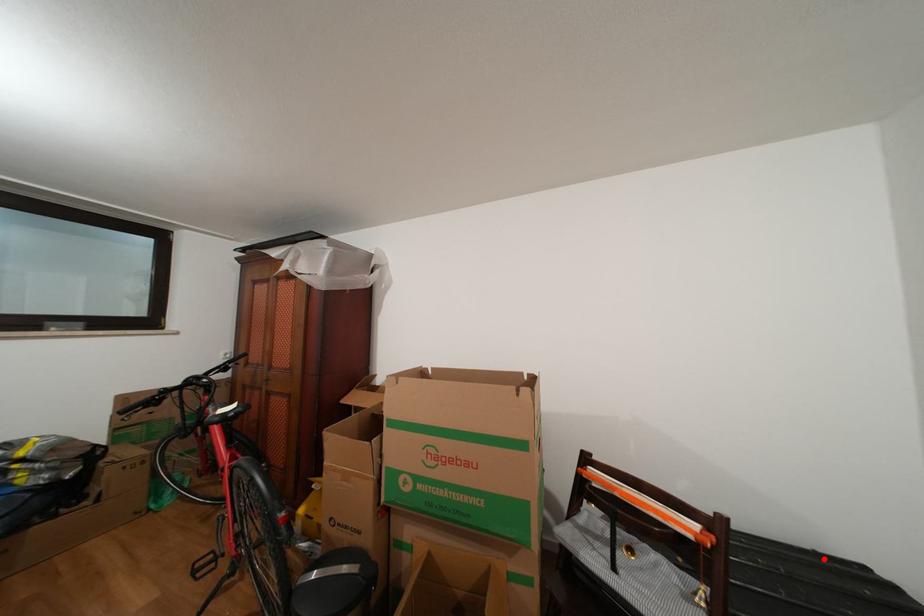
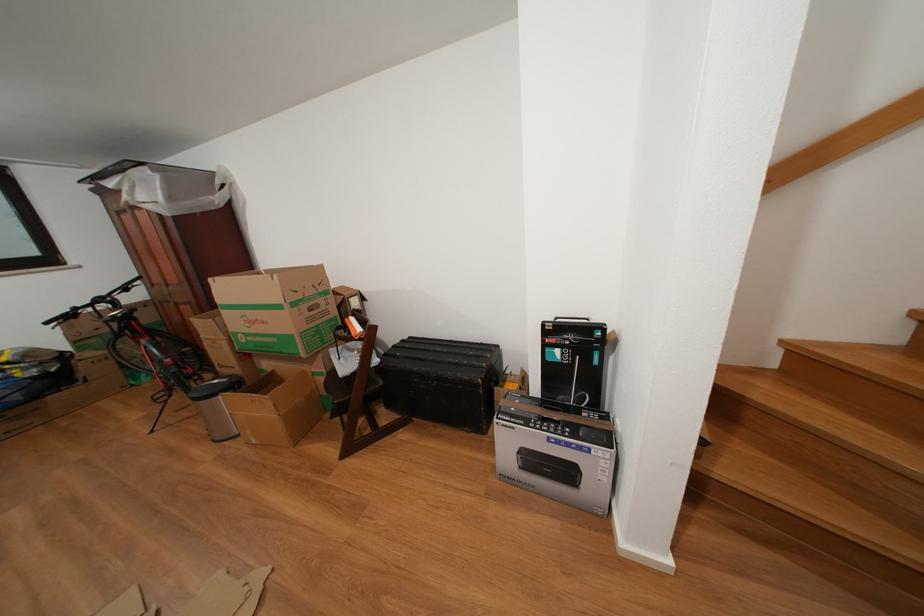
Question: I am providing you with two images of the same scene from different viewpoints. A red point is shown in image1. For the corresponding object point in image2, is it positioned nearer or farther from the camera?

Choices:
 (A) Nearer
 (B) Farther

Answer: (B)